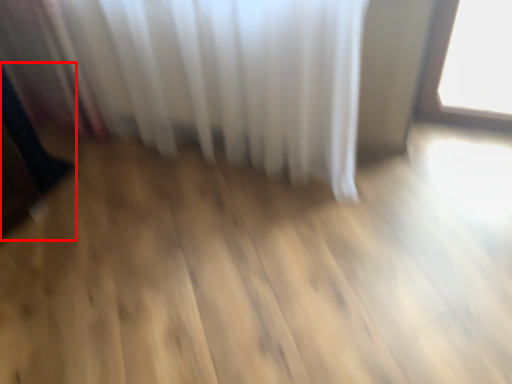
Question: From the image's perspective, where is dark (annotated by the red box) located in relation to curtain in the image?

Choices:
 (A) above
 (B) below

Answer: (B)